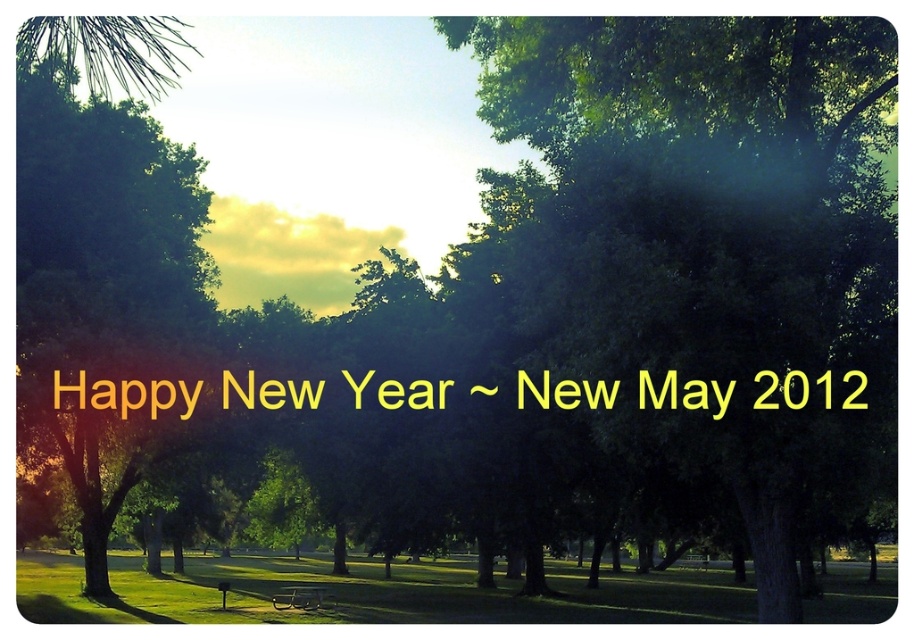
You are standing in the park and want to walk from the point closer to you to the point further away. Which path would you take between the two points, point (274, 380) and point (307, 602)?

You should walk from point (274, 380) to point (307, 602) because point (274, 380) is closer to the viewer and the other point is further away.

You are a visitor in the park and want to read the yellow metallic text at center. Where should you look relative to the wooden park bench at lower center?

The yellow metallic text at center is positioned over the wooden park bench at lower center, so you should look directly above the wooden park bench at lower center to see it.